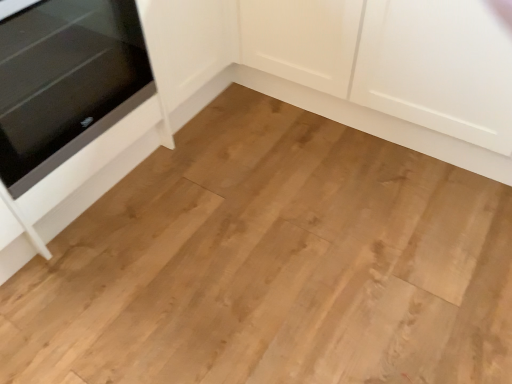
Question: In the image, is white matte cabinet at center on the left side or the right side of black glass oven at left?

Choices:
 (A) right
 (B) left

Answer: (A)

Question: Does point (387, 54) appear closer or farther from the camera than point (93, 3)?

Choices:
 (A) farther
 (B) closer

Answer: (A)

Question: Considering the positions of white matte cabinet at center and black glass oven at left in the image, is white matte cabinet at center taller or shorter than black glass oven at left?

Choices:
 (A) tall
 (B) short

Answer: (A)

Question: Is black glass oven at left situated inside white matte cabinet at center or outside?

Choices:
 (A) inside
 (B) outside

Answer: (B)

Question: Considering the positions of black glass oven at left and white matte cabinet at center in the image, is black glass oven at left taller or shorter than white matte cabinet at center?

Choices:
 (A) short
 (B) tall

Answer: (A)

Question: In terms of width, does black glass oven at left look wider or thinner when compared to white matte cabinet at center?

Choices:
 (A) wide
 (B) thin

Answer: (A)

Question: From the image's perspective, is black glass oven at left positioned above or below white matte cabinet at center?

Choices:
 (A) above
 (B) below

Answer: (B)